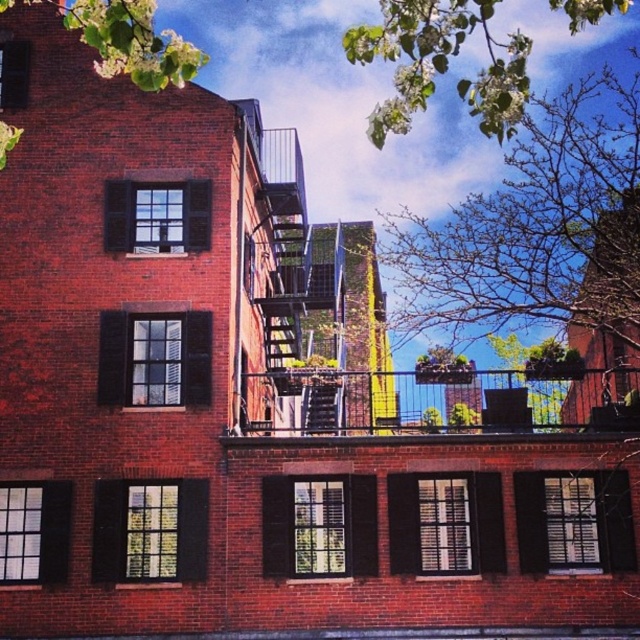
You are an architect analyzing the building facade. Which object, the metallic silver balcony at center or the green leafy branches at upper center, occupies a larger area on the building?

The green leafy branches at upper center occupy a larger area on the building since the metallic silver balcony at center has a smaller size compared to them.

You are a photographer standing in front of the red brick building. You notice a point marked at coordinates (442, 64) on your camera screen. What object is located at that point?

The point at coordinates (442, 64) marks green leafy branches at upper center.